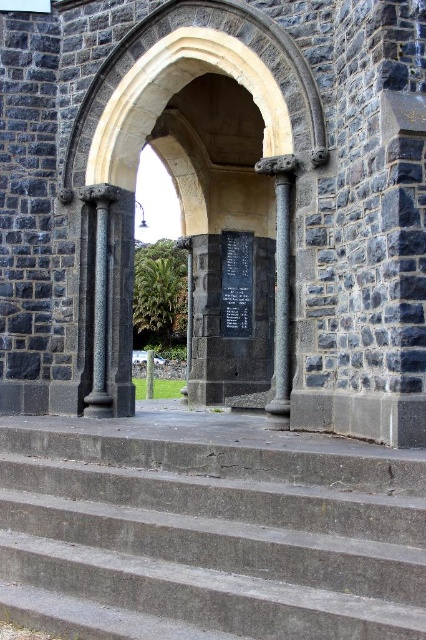
Is dark gray stone arch at center smaller than gray stone column at center?

No, dark gray stone arch at center is not smaller than gray stone column at center.

Between point (117, 225) and point (279, 292), which one is positioned behind?

The point (117, 225) is behind.

Which is in front, point (83, 120) or point (282, 321)?

Positioned in front is point (282, 321).

This screenshot has height=640, width=426. I want to click on dark gray stone arch at center, so click(186, 145).

Does gray concrete stairs at center have a greater height compared to black polished stone plaque at center?

No, gray concrete stairs at center is not taller than black polished stone plaque at center.

Is gray concrete stairs at center closer to the viewer compared to black polished stone plaque at center?

Yes, it is.

Locate an element on the screen. The height and width of the screenshot is (640, 426). gray concrete stairs at center is located at coordinates (209, 538).

Which is more to the left, gray concrete stairs at center or gray stone column at center?

From the viewer's perspective, gray concrete stairs at center appears more on the left side.

The width and height of the screenshot is (426, 640). Describe the element at coordinates (209, 538) in the screenshot. I see `gray concrete stairs at center` at that location.

Where is `gray concrete stairs at center`? gray concrete stairs at center is located at coordinates (209, 538).